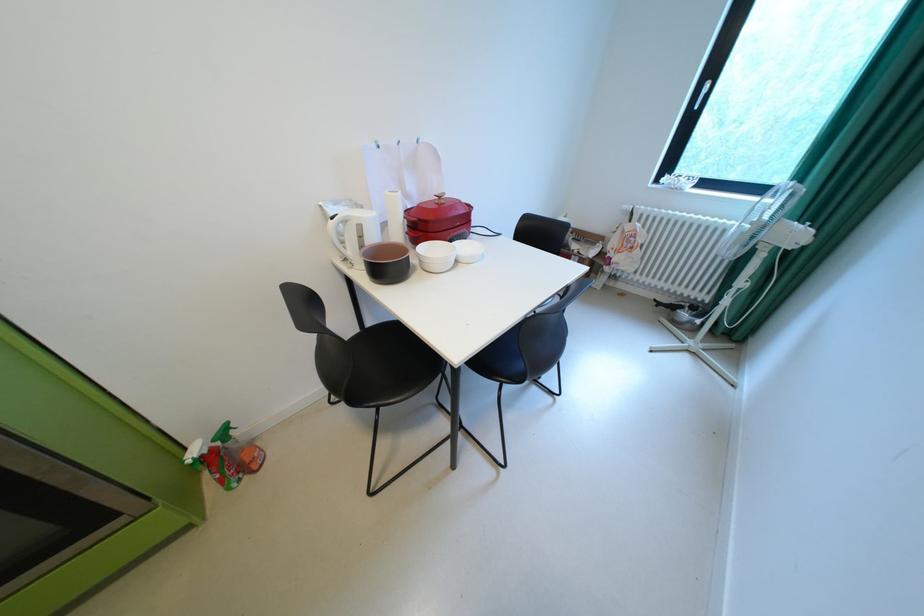
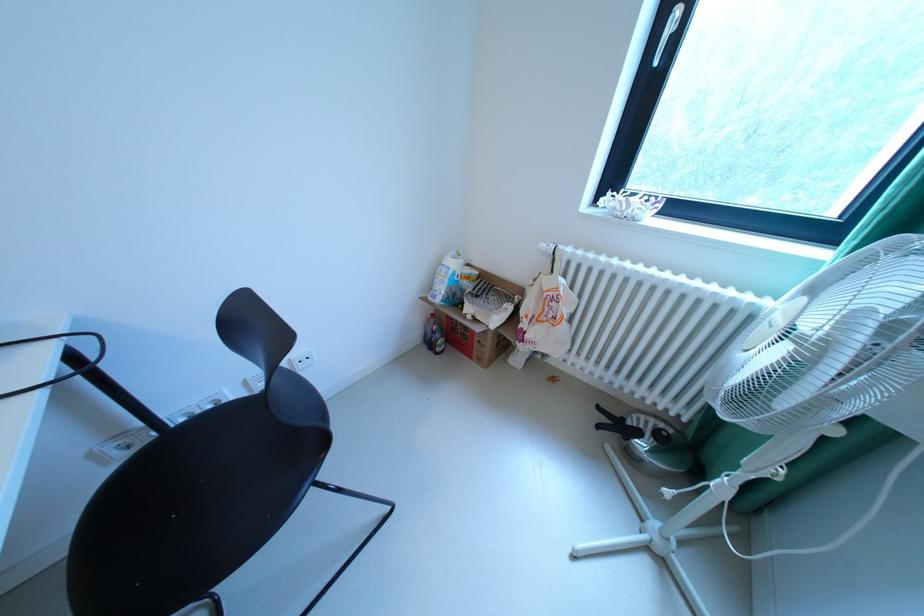
What movement of the cameraman would produce the second image?

The movement direction of the cameraman is right, forward.